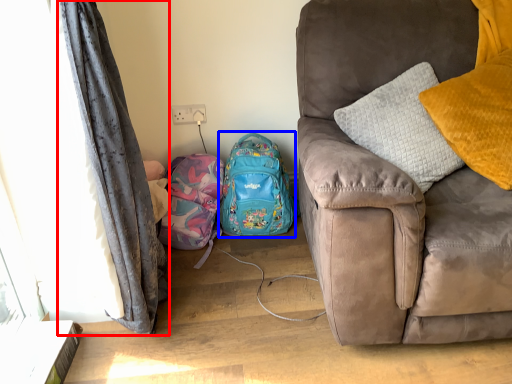
Question: Among these objects, which one is nearest to the camera, curtain (highlighted by a red box) or backpack (highlighted by a blue box)?

Choices:
 (A) curtain
 (B) backpack

Answer: (A)